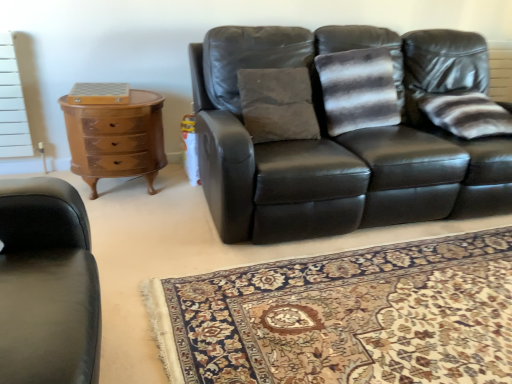
Question: In the image, is matte black leather couch at center on the left side or the right side of carpet with intricate floral pattern at center?

Choices:
 (A) left
 (B) right

Answer: (B)

Question: Is matte black leather couch at center wider or thinner than carpet with intricate floral pattern at center?

Choices:
 (A) wide
 (B) thin

Answer: (B)

Question: Which object is the farthest from the striped fabric pillow at right?

Choices:
 (A) matte black leather couch at center
 (B) carpet with intricate floral pattern at center
 (C) wooden glossy chest of drawers at left

Answer: (C)

Question: Based on their relative distances, which object is farther from the matte black leather couch at center?

Choices:
 (A) carpet with intricate floral pattern at center
 (B) wooden glossy chest of drawers at left
 (C) striped fabric pillow at right

Answer: (B)